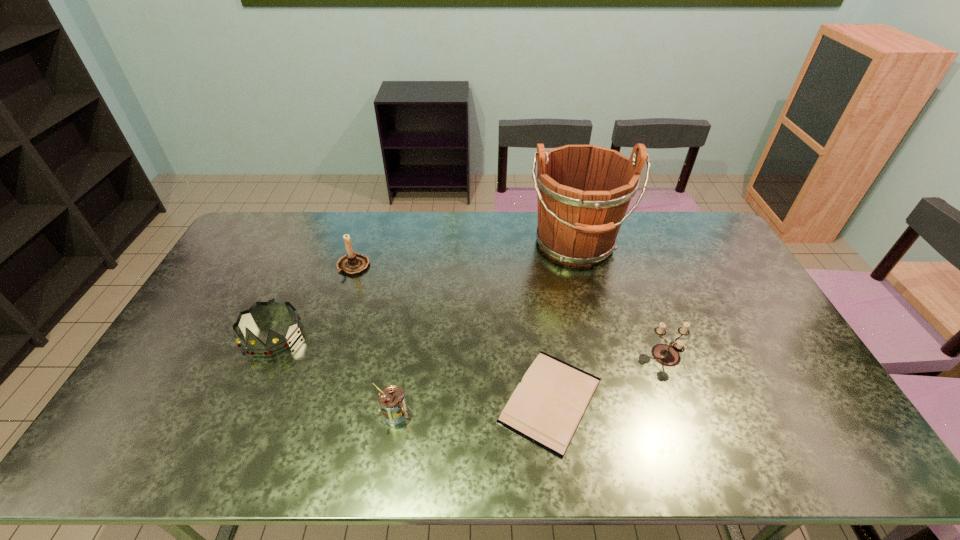
Identify the location of free space located at the front of the leftmost object with jewels. (231, 424).

Find the location of a particular element. This screenshot has height=540, width=960. vacant space located 0.310m on the back of the shorter candle holder is located at coordinates (635, 273).

The height and width of the screenshot is (540, 960). What are the coordinates of `free spot located 0.220m on the right of the fourth object from right to left` in the screenshot? It's located at (498, 413).

Where is `free space located 0.250m on the left of the shortest object`? free space located 0.250m on the left of the shortest object is located at coordinates (400, 400).

Image resolution: width=960 pixels, height=540 pixels. What are the coordinates of `object that is at the far edge` in the screenshot? It's located at (583, 191).

This screenshot has width=960, height=540. What are the coordinates of `object that is positioned at the near edge` in the screenshot? It's located at (546, 408).

In the image, there is a desktop. Where is `vacant space at the far edge`? Image resolution: width=960 pixels, height=540 pixels. vacant space at the far edge is located at coordinates (373, 227).

This screenshot has height=540, width=960. I want to click on free location at the near edge, so click(445, 440).

Locate an element on the screen. Image resolution: width=960 pixels, height=540 pixels. vacant space at the left edge of the desktop is located at coordinates (256, 284).

Where is `vacant area at the right edge of the desktop`? The width and height of the screenshot is (960, 540). vacant area at the right edge of the desktop is located at coordinates (708, 282).